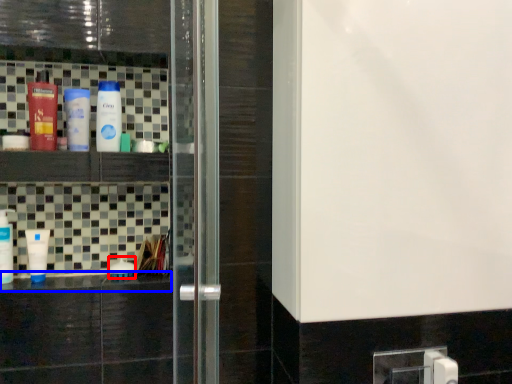
Question: Which object is further to the camera taking this photo, bottle (highlighted by a red box) or counter top (highlighted by a blue box)?

Choices:
 (A) bottle
 (B) counter top

Answer: (A)